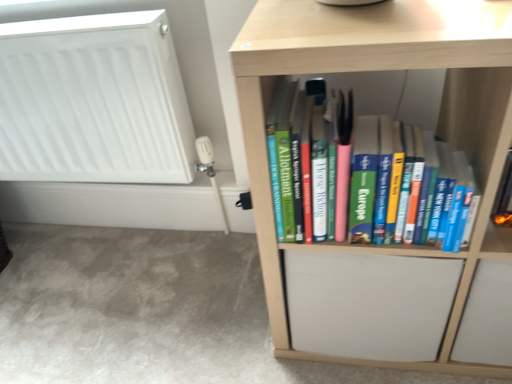
Image resolution: width=512 pixels, height=384 pixels. Identify the location of white matte radiator at upper left. (93, 101).

The height and width of the screenshot is (384, 512). What do you see at coordinates (93, 101) in the screenshot?
I see `white matte radiator at upper left` at bounding box center [93, 101].

The image size is (512, 384). I want to click on light wood bookshelf at center, so click(x=359, y=71).

This screenshot has width=512, height=384. What do you see at coordinates (359, 71) in the screenshot?
I see `light wood bookshelf at center` at bounding box center [359, 71].

The width and height of the screenshot is (512, 384). In order to click on white matte radiator at upper left in this screenshot , I will do `click(93, 101)`.

Considering the relative positions of white matte radiator at upper left and light wood bookshelf at center in the image provided, is white matte radiator at upper left to the left of light wood bookshelf at center from the viewer's perspective?

Indeed, white matte radiator at upper left is positioned on the left side of light wood bookshelf at center.

Which object is further away from the camera taking this photo, white matte radiator at upper left or light wood bookshelf at center?

white matte radiator at upper left is more distant.

Is point (42, 52) closer or farther from the camera than point (266, 106)?

Point (42, 52).

From the image's perspective, which one is positioned lower, white matte radiator at upper left or light wood bookshelf at center?

light wood bookshelf at center is shown below in the image.

From a real-world perspective, is white matte radiator at upper left on light wood bookshelf at center?

Yes, from a real-world perspective, white matte radiator at upper left is above light wood bookshelf at center.

Can you confirm if white matte radiator at upper left is thinner than light wood bookshelf at center?

Yes, white matte radiator at upper left is thinner than light wood bookshelf at center.

Considering the sizes of objects white matte radiator at upper left and light wood bookshelf at center in the image provided, who is taller, white matte radiator at upper left or light wood bookshelf at center?

light wood bookshelf at center is taller.

Is white matte radiator at upper left smaller than light wood bookshelf at center?

Yes, white matte radiator at upper left is smaller than light wood bookshelf at center.

Choose the correct answer: Is white matte radiator at upper left inside light wood bookshelf at center or outside it?

white matte radiator at upper left lies outside light wood bookshelf at center.

Is there a large distance between white matte radiator at upper left and light wood bookshelf at center?

No, white matte radiator at upper left is in close proximity to light wood bookshelf at center.

Is white matte radiator at upper left positioned with its back to light wood bookshelf at center?

No, white matte radiator at upper left is not facing away from light wood bookshelf at center.

Find the location of a particular element. This screenshot has width=512, height=384. radiator that is above the light wood bookshelf at center (from the image's perspective) is located at coordinates (93, 101).

Between light wood bookshelf at center and white matte radiator at upper left, which one appears on the right side from the viewer's perspective?

light wood bookshelf at center is more to the right.

Is light wood bookshelf at center further to the viewer compared to white matte radiator at upper left?

No, the depth of light wood bookshelf at center is less than that of white matte radiator at upper left.

Which point is more distant from viewer, (464, 367) or (5, 127)?

The point (5, 127) is behind.

Looking at this image, from the image's perspective, is light wood bookshelf at center above white matte radiator at upper left?

No.

From a real-world perspective, is light wood bookshelf at center beneath white matte radiator at upper left?

Correct, in the physical world, light wood bookshelf at center is lower than white matte radiator at upper left.

Considering the relative sizes of light wood bookshelf at center and white matte radiator at upper left in the image provided, is light wood bookshelf at center thinner than white matte radiator at upper left?

No.

Which of these two, light wood bookshelf at center or white matte radiator at upper left, stands taller?

Standing taller between the two is light wood bookshelf at center.

Considering the sizes of objects light wood bookshelf at center and white matte radiator at upper left in the image provided, who is smaller, light wood bookshelf at center or white matte radiator at upper left?

white matte radiator at upper left.

Is white matte radiator at upper left inside light wood bookshelf at center?

No, white matte radiator at upper left is not a part of light wood bookshelf at center.

Is light wood bookshelf at center not close to white matte radiator at upper left?

light wood bookshelf at center is actually quite close to white matte radiator at upper left.

Could you tell me if light wood bookshelf at center is turned towards white matte radiator at upper left?

No, light wood bookshelf at center is not turned towards white matte radiator at upper left.

How many degrees apart are the facing directions of light wood bookshelf at center and white matte radiator at upper left?

The angular difference between light wood bookshelf at center and white matte radiator at upper left is 0.248 degrees.

How far apart are light wood bookshelf at center and white matte radiator at upper left?

light wood bookshelf at center is 23.41 inches away from white matte radiator at upper left.

Identify the location of radiator above the light wood bookshelf at center (from the image's perspective). point(93,101).

The height and width of the screenshot is (384, 512). I want to click on shelf below the white matte radiator at upper left (from the image's perspective), so click(x=359, y=71).

Identify the location of shelf directly beneath the white matte radiator at upper left (from a real-world perspective). (359, 71).